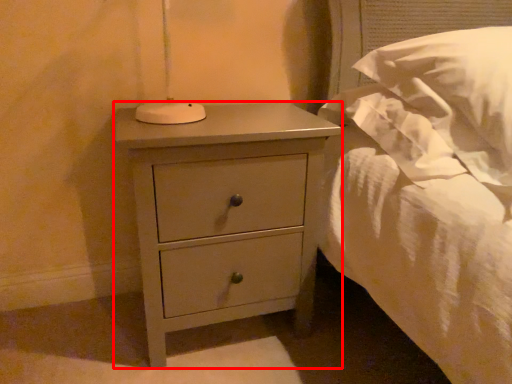
Question: Considering the relative positions of nightstand (annotated by the red box) and pillow in the image provided, where is nightstand (annotated by the red box) located with respect to the staircase?

Choices:
 (A) right
 (B) left

Answer: (B)